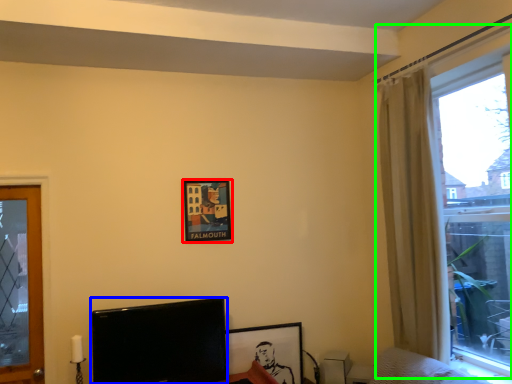
Question: Which object is the farthest from picture frame (highlighted by a red box)? Choose among these: television (highlighted by a blue box) or window (highlighted by a green box).

Choices:
 (A) television
 (B) window

Answer: (B)